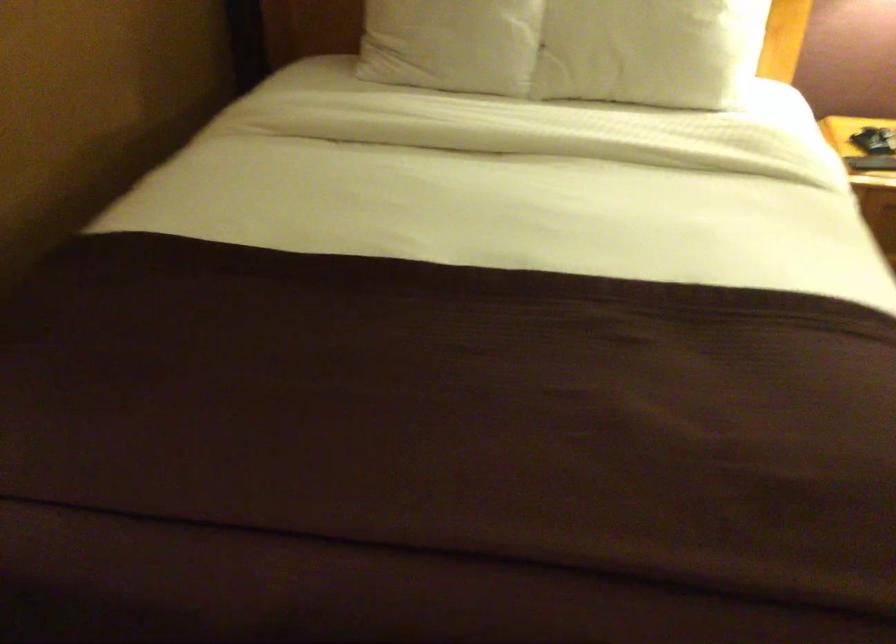
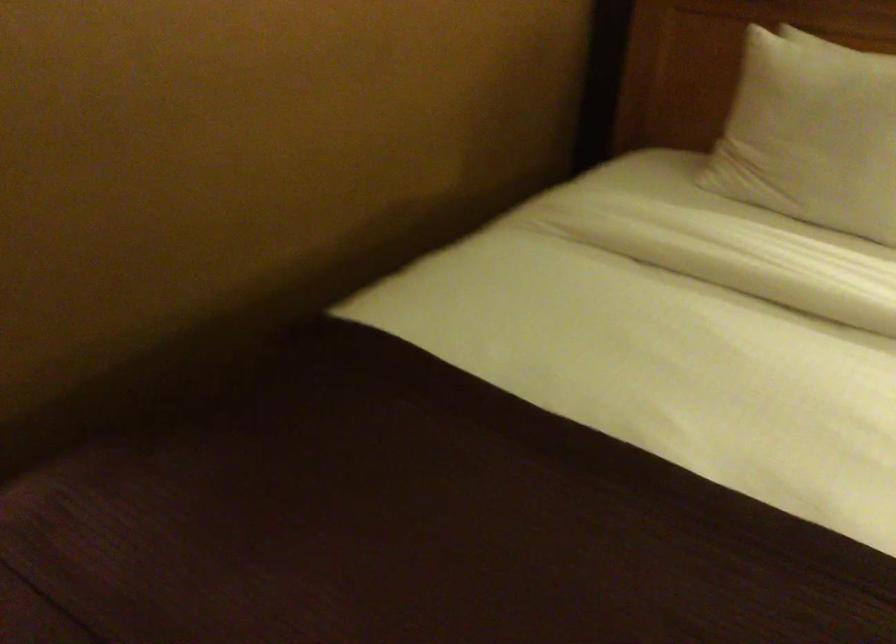
Question: The camera is either moving clockwise (left) or counter-clockwise (right) around the object. The first image is from the beginning of the video and the second image is from the end. Is the camera moving left or right when shooting the video?

Choices:
 (A) Left
 (B) Right

Answer: (B)